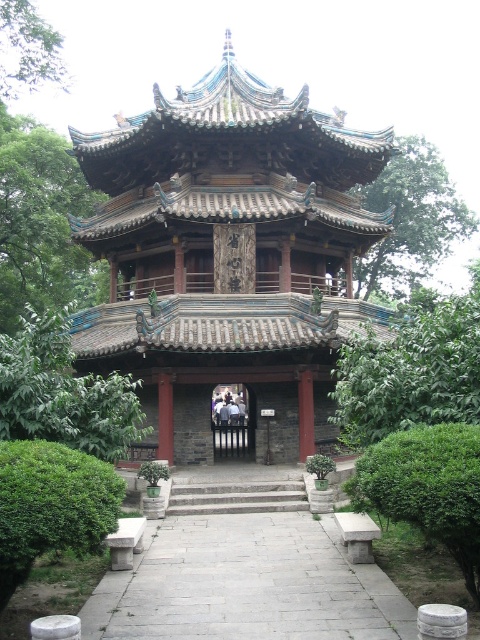
Question: Is blue-tiled pagoda at center smaller than gray stone path at center?

Choices:
 (A) yes
 (B) no

Answer: (B)

Question: Among these points, which one is farthest from the camera?

Choices:
 (A) (180, 259)
 (B) (290, 481)

Answer: (A)

Question: Can you confirm if gray stone path at center is positioned below stone steps at center?

Choices:
 (A) yes
 (B) no

Answer: (A)

Question: Among these objects, which one is nearest to the camera?

Choices:
 (A) blue-tiled pagoda at center
 (B) stone steps at center
 (C) gray stone path at center

Answer: (C)

Question: Which of the following is the farthest from the observer?

Choices:
 (A) (254, 413)
 (B) (228, 624)
 (C) (283, 504)

Answer: (A)

Question: Is blue-tiled pagoda at center positioned before stone steps at center?

Choices:
 (A) no
 (B) yes

Answer: (A)